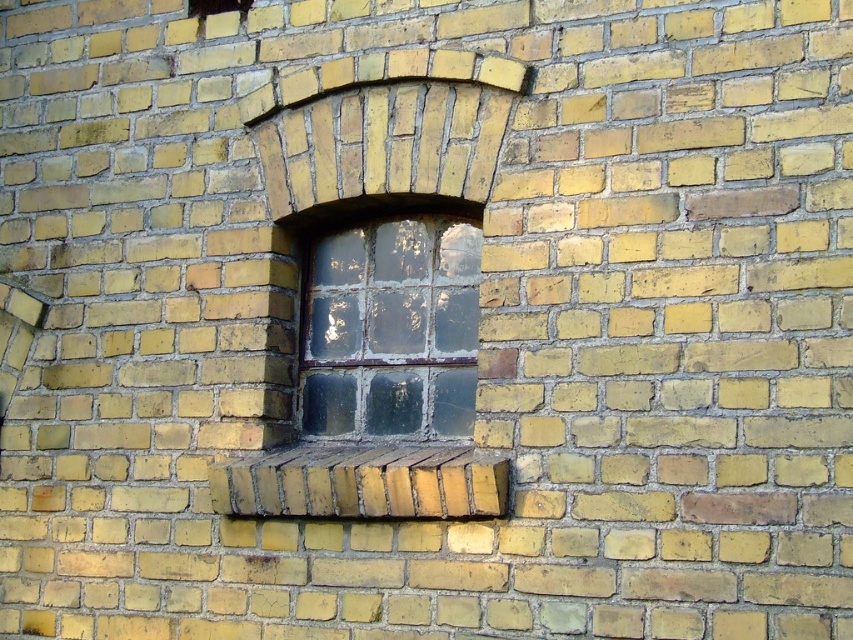
Question: Can you confirm if clear glass window at center is thinner than yellow brick at center?

Choices:
 (A) yes
 (B) no

Answer: (A)

Question: Is the position of clear glass window at center more distant than that of yellow brick at center?

Choices:
 (A) yes
 (B) no

Answer: (A)

Question: Which object appears closest to the camera in this image?

Choices:
 (A) clear glass window at center
 (B) yellow brick at center

Answer: (B)

Question: In this image, where is clear glass window at center located relative to yellow brick at center?

Choices:
 (A) right
 (B) left

Answer: (A)

Question: Which object appears farthest from the camera in this image?

Choices:
 (A) clear glass window at center
 (B) yellow brick at center

Answer: (A)